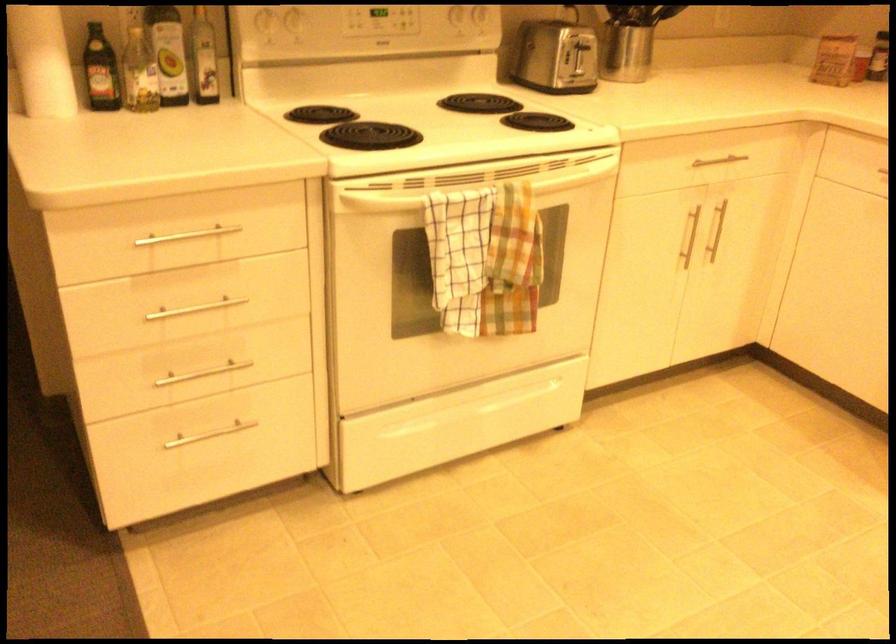
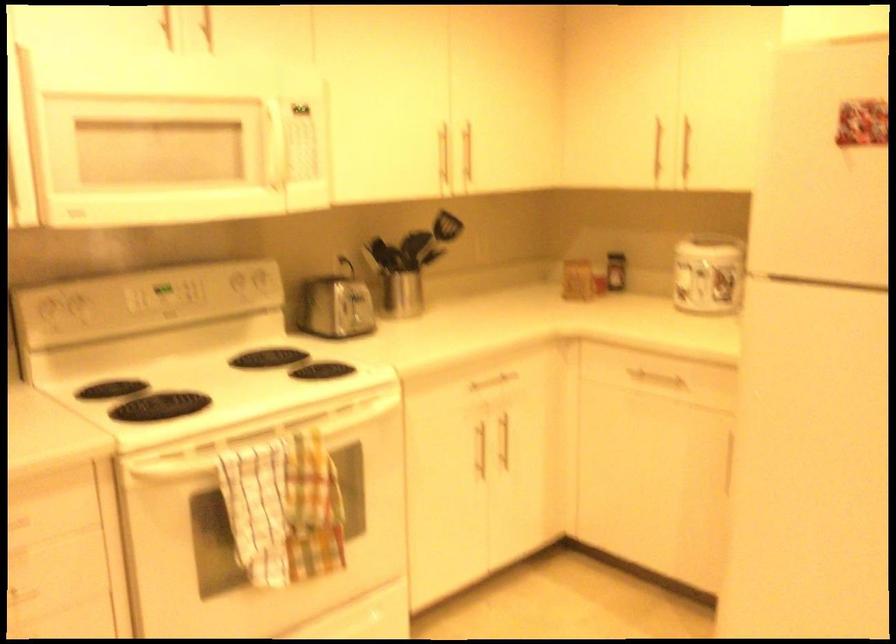
Question: The first image is from the beginning of the video and the second image is from the end. How did the camera likely rotate when shooting the video?

Choices:
 (A) Left
 (B) Right
 (C) Up
 (D) Down

Answer: (C)